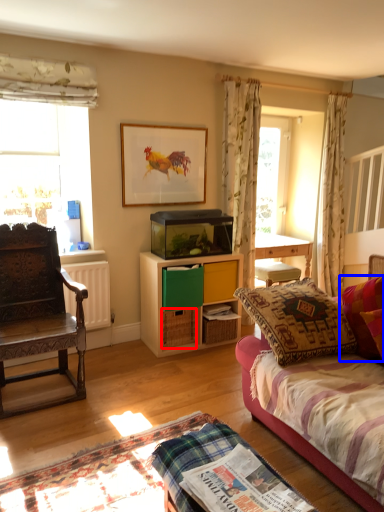
Question: Which point is further to the camera, drawer (highlighted by a red box) or pillow (highlighted by a blue box)?

Choices:
 (A) drawer
 (B) pillow

Answer: (A)